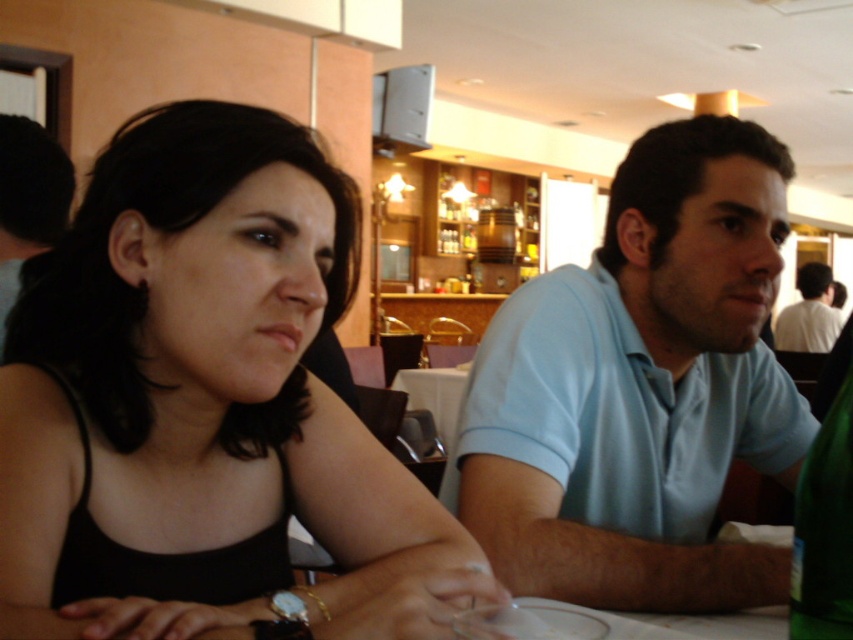
Question: Which of these objects is positioned closest to the black matte tank top at center?

Choices:
 (A) black hair at left
 (B) light blue cotton shirt at center
 (C) green glass bottle at right

Answer: (B)

Question: Which is nearer to the white shirt at upper right?

Choices:
 (A) green glass bottle at right
 (B) black matte tank top at center

Answer: (B)

Question: Is light blue cotton shirt at center to the right of black hair at left from the viewer's perspective?

Choices:
 (A) yes
 (B) no

Answer: (A)

Question: Can you confirm if black matte tank top at center is wider than light blue cotton shirt at center?

Choices:
 (A) yes
 (B) no

Answer: (B)

Question: Can you confirm if black matte tank top at center is smaller than light blue cotton shirt at center?

Choices:
 (A) yes
 (B) no

Answer: (A)

Question: Which point appears farthest from the camera in this image?

Choices:
 (A) (817, 266)
 (B) (523, 428)

Answer: (A)